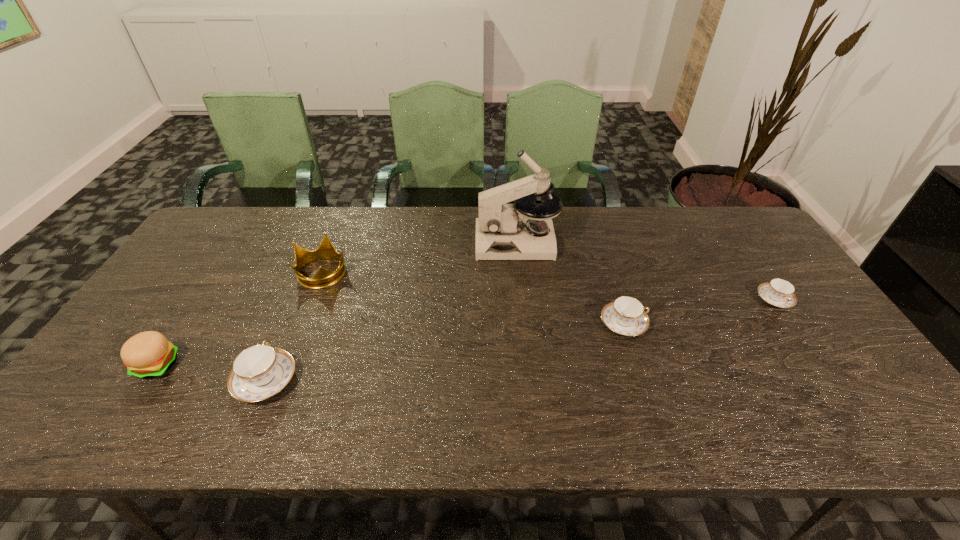
At what (x,y) coordinates should I click in order to perform the action: click on free space located 0.070m on the side with the handle of the tallest teacup. Please return your answer as a coordinate pair (x, y). Looking at the image, I should click on (285, 333).

Find the location of a particular element. This screenshot has height=540, width=960. vacant space located 0.050m on the side with the handle of the tallest teacup is located at coordinates (282, 339).

The image size is (960, 540). What are the coordinates of `vacant space located on the side with the handle of the tallest teacup` in the screenshot? It's located at (300, 295).

Where is `free region located 0.290m on the side with the handle of the second shortest teacup`? Image resolution: width=960 pixels, height=540 pixels. free region located 0.290m on the side with the handle of the second shortest teacup is located at coordinates (756, 323).

This screenshot has height=540, width=960. I want to click on blank space located 0.100m on the side with the handle of the shortest object, so click(803, 341).

The image size is (960, 540). What are the coordinates of `vacant space located on the left of the crown` in the screenshot? It's located at (x=194, y=272).

Find the location of a particular element. This screenshot has height=540, width=960. vacant space located at the eyepiece of the tallest object is located at coordinates (442, 242).

This screenshot has height=540, width=960. I want to click on free space located at the eyepiece of the tallest object, so click(x=380, y=242).

Locate an element on the screen. This screenshot has width=960, height=540. vacant space located at the eyepiece of the tallest object is located at coordinates (408, 242).

Find the location of a particular element. free point located on the right of the leftmost object is located at coordinates (202, 364).